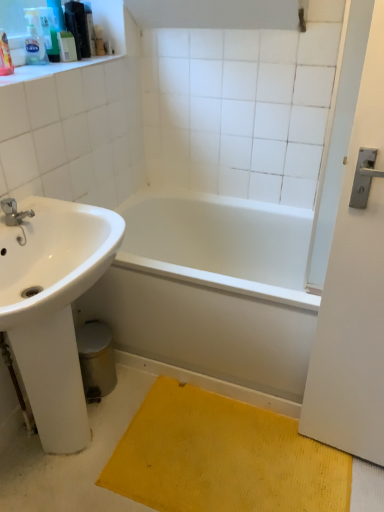
Question: Is translucent plastic soap dispenser at upper left, which is counted as the 2th toiletry, starting from the left, positioned beyond the bounds of white glossy bathtub at center?

Choices:
 (A) no
 (B) yes

Answer: (B)

Question: Can you confirm if translucent plastic soap dispenser at upper left, which is counted as the 2th toiletry, starting from the left, is taller than white glossy bathtub at center?

Choices:
 (A) yes
 (B) no

Answer: (B)

Question: Is translucent plastic soap dispenser at upper left, the second toiletry viewed from the right, positioned in front of white glossy bathtub at center?

Choices:
 (A) yes
 (B) no

Answer: (B)

Question: Is translucent plastic soap dispenser at upper left, which is counted as the 2th toiletry, starting from the left, smaller than white glossy bathtub at center?

Choices:
 (A) no
 (B) yes

Answer: (B)

Question: From a real-world perspective, is translucent plastic soap dispenser at upper left, which is counted as the 2th toiletry, starting from the left, positioned under white glossy bathtub at center based on gravity?

Choices:
 (A) no
 (B) yes

Answer: (A)

Question: Does translucent plastic soap dispenser at upper left, the second toiletry viewed from the right, have a lesser height compared to white glossy bathtub at center?

Choices:
 (A) yes
 (B) no

Answer: (A)

Question: From a real-world perspective, is white plastic container at upper left, which appears as the third toiletry when viewed from the left, positioned under brushed metal faucet at left based on gravity?

Choices:
 (A) no
 (B) yes

Answer: (A)

Question: From a real-world perspective, does white plastic container at upper left, which appears as the third toiletry when viewed from the left, stand above brushed metal faucet at left?

Choices:
 (A) no
 (B) yes

Answer: (B)

Question: Does white plastic container at upper left, which appears as the third toiletry when viewed from the left, have a lesser height compared to brushed metal faucet at left?

Choices:
 (A) yes
 (B) no

Answer: (B)

Question: Does white plastic container at upper left, which appears as the third toiletry when viewed from the left, have a lesser width compared to brushed metal faucet at left?

Choices:
 (A) yes
 (B) no

Answer: (A)

Question: Considering the relative positions of white plastic container at upper left, which appears as the third toiletry when viewed from the left, and brushed metal faucet at left in the image provided, is white plastic container at upper left, which appears as the third toiletry when viewed from the left, in front of brushed metal faucet at left?

Choices:
 (A) yes
 (B) no

Answer: (B)

Question: Considering the relative sizes of white plastic container at upper left, which appears as the third toiletry when viewed from the left, and brushed metal faucet at left in the image provided, is white plastic container at upper left, which appears as the third toiletry when viewed from the left, taller than brushed metal faucet at left?

Choices:
 (A) yes
 (B) no

Answer: (A)

Question: Considering the relative sizes of translucent plastic soap dispenser at upper left, which is counted as the 3th toiletry, starting from the right, and translucent plastic soap dispenser at upper left, which is counted as the 2th toiletry, starting from the left, in the image provided, is translucent plastic soap dispenser at upper left, which is counted as the 3th toiletry, starting from the right, shorter than translucent plastic soap dispenser at upper left, which is counted as the 2th toiletry, starting from the left,?

Choices:
 (A) yes
 (B) no

Answer: (A)